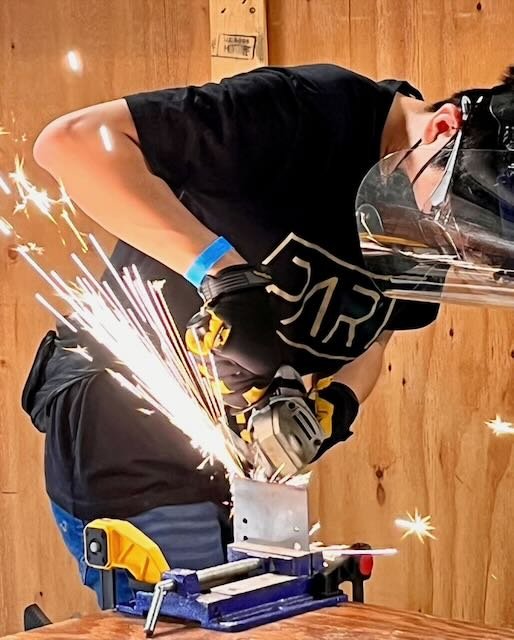
I want to click on wood table, so click(372, 612).